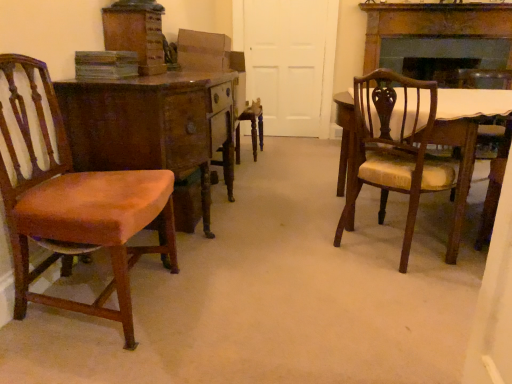
In order to click on vacant area situated to the left side of matte brown chair at right, positioned as the first chair in right-to-left order in this screenshot , I will do `click(308, 254)`.